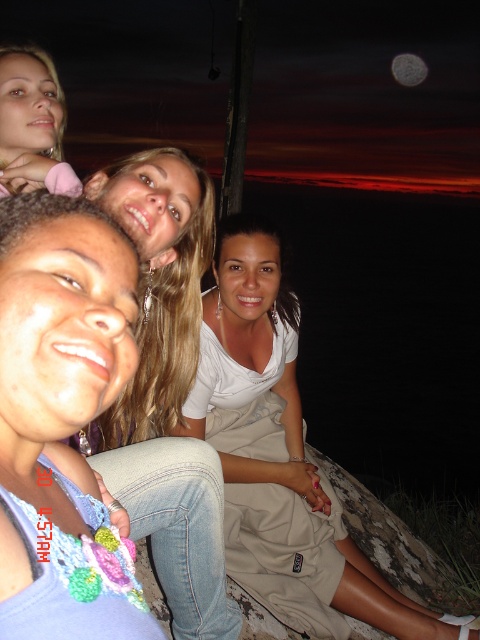
You are a photographer trying to capture a closeup shot of both the matte purple shirt at center and the matte pink hair clip at upper left. Given that your camera lens has a maximum focus range of 30 inches, will you be able to capture both subjects in focus without moving your position?

The matte purple shirt at center is 35.27 inches away from the matte pink hair clip at upper left. Since the distance between them exceeds the camera lens maximum focus range of 30 inches, you will not be able to capture both subjects in focus without moving closer or adjusting your position.

In the scene shown: You are a photographer trying to capture a group photo of the matte purple shirt at center and the white cotton dress at center. Since you want to focus on the details of both outfits, which one should you zoom in on more to ensure clarity?

The matte purple shirt at center has a lesser width compared to the white cotton dress at center, so you should zoom in more on the white cotton dress at center to ensure its details are captured clearly.

You are a photographer trying to capture the group in the scene. You notice the matte purple shirt at center and the white cotton dress at center. Which clothing item takes up more visual space in the photo?

The white cotton dress at center takes up more visual space than the matte purple shirt at center because the matte purple shirt at center occupies less space than white cotton dress at center.